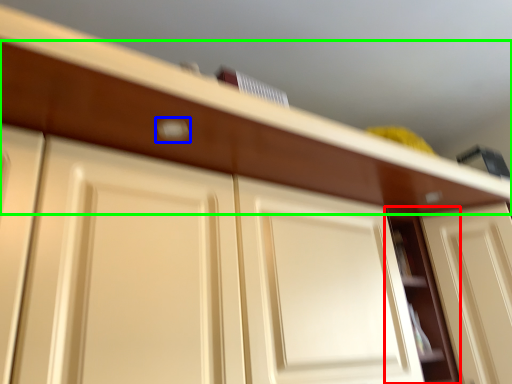
Question: Which is farther away from cabinet (highlighted by a red box)? door handle (highlighted by a blue box) or drawer (highlighted by a green box)?

Choices:
 (A) door handle
 (B) drawer

Answer: (A)